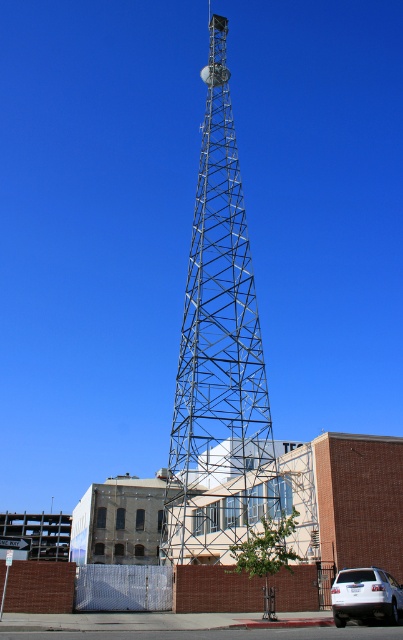
Question: Is metallic lattice tower at center to the right of white matte suv at lower right from the viewer's perspective?

Choices:
 (A) yes
 (B) no

Answer: (B)

Question: Which of the following is the farthest from the observer?

Choices:
 (A) (371, 608)
 (B) (230, 435)

Answer: (B)

Question: Which of the following is the farthest from the observer?

Choices:
 (A) metallic lattice tower at center
 (B) white matte suv at lower right

Answer: (A)

Question: Which point appears closest to the camera in this image?

Choices:
 (A) (209, 436)
 (B) (396, 605)

Answer: (B)

Question: Does metallic lattice tower at center have a smaller size compared to white matte suv at lower right?

Choices:
 (A) yes
 (B) no

Answer: (B)

Question: Can you confirm if metallic lattice tower at center is bigger than white matte suv at lower right?

Choices:
 (A) yes
 (B) no

Answer: (A)